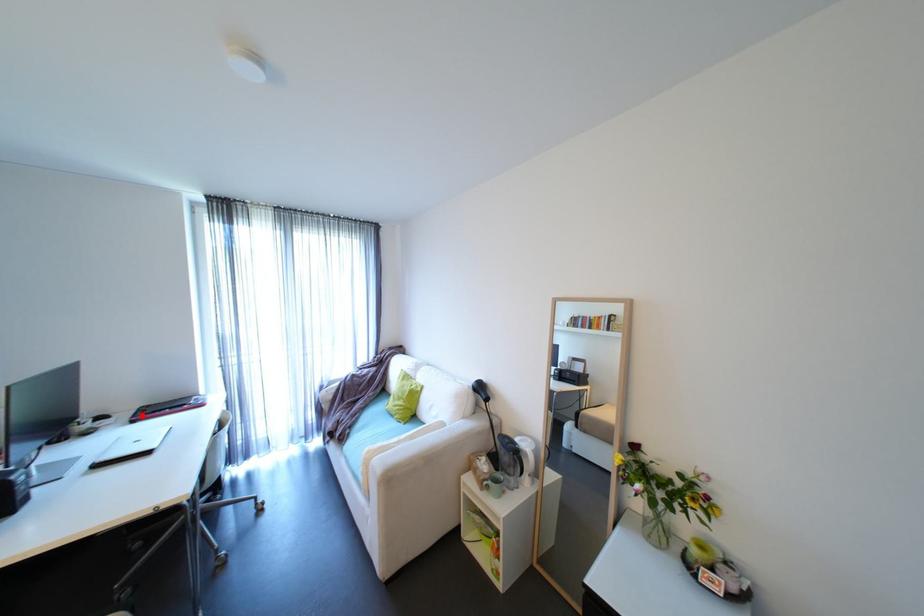
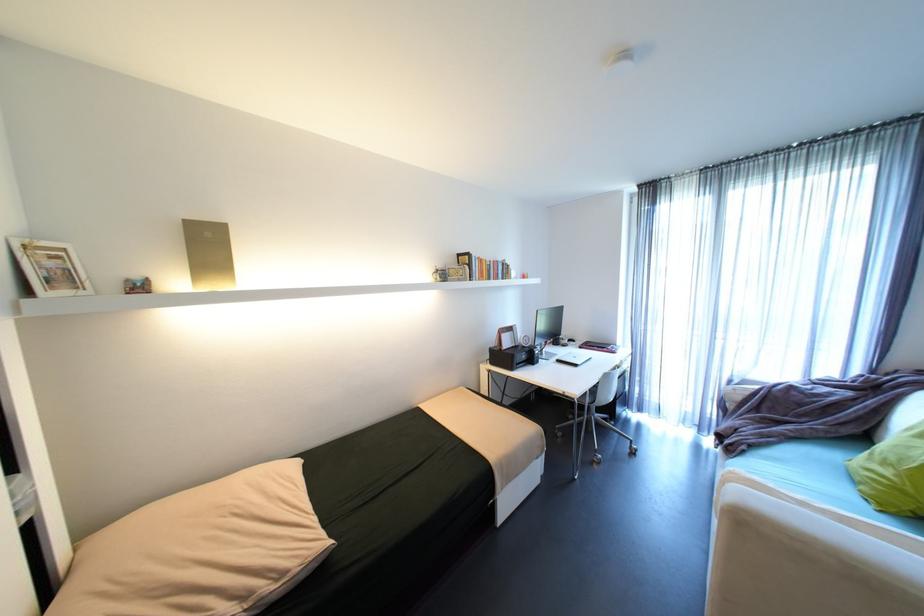
The point at the highlighted location is marked in the first image. Where is the corresponding point in the second image?

(589, 344)